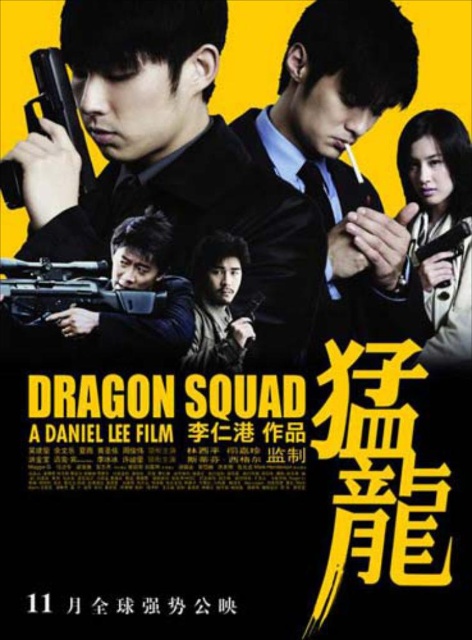
Can you confirm if matte black gun at center is taller than dark brown leather jacket at center?

Correct, matte black gun at center is much taller as dark brown leather jacket at center.

Does matte black gun at center have a larger size compared to dark brown leather jacket at center?

Yes.

Is point (152, 36) closer to viewer compared to point (237, 337)?

That is True.

Find the location of a particular element. matte black gun at center is located at coordinates (169, 161).

Is point (321, 211) closer to camera compared to point (40, 275)?

No, (321, 211) is behind (40, 275).

Does matte black suit at center have a greater width compared to matte black sniper rifle at center?

Indeed, matte black suit at center has a greater width compared to matte black sniper rifle at center.

Which is in front, point (291, 177) or point (64, 264)?

Point (64, 264) is more forward.

Where is `matte black suit at center`? The width and height of the screenshot is (472, 640). matte black suit at center is located at coordinates (343, 150).

Who is positioned more to the left, matte black sniper rifle at center or polished silver pistol at upper left?

polished silver pistol at upper left

Between point (7, 291) and point (30, 116), which one is positioned in front?

Point (7, 291) is in front.

At what (x,y) coordinates should I click in order to perform the action: click on matte black sniper rifle at center. Please return your answer as a coordinate pair (x, y). Looking at the image, I should click on 74,285.